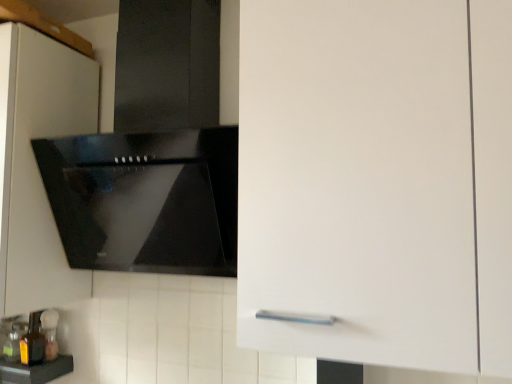
Question: Is white matte cabinet at upper left located outside black glossy countertop at lower left?

Choices:
 (A) yes
 (B) no

Answer: (A)

Question: From a real-world perspective, is white matte cabinet at upper left located beneath black glossy countertop at lower left?

Choices:
 (A) no
 (B) yes

Answer: (A)

Question: Considering the relative positions of white matte cabinet at upper left and black glossy countertop at lower left in the image provided, is white matte cabinet at upper left to the left of black glossy countertop at lower left from the viewer's perspective?

Choices:
 (A) yes
 (B) no

Answer: (B)

Question: Can you confirm if white matte cabinet at upper left is thinner than black glossy countertop at lower left?

Choices:
 (A) yes
 (B) no

Answer: (B)

Question: Is black glossy countertop at lower left inside white matte cabinet at upper left?

Choices:
 (A) yes
 (B) no

Answer: (B)

Question: In terms of width, does translucent glass bottle at lower left, marked as the second bottle in a front-to-back arrangement, look wider or thinner when compared to translucent amber bottle at lower left, which appears as the 1th bottle when viewed from the front?

Choices:
 (A) wide
 (B) thin

Answer: (B)

Question: From a real-world perspective, is translucent glass bottle at lower left, marked as the second bottle in a front-to-back arrangement, physically located above or below translucent amber bottle at lower left, positioned as the second bottle in back-to-front order?

Choices:
 (A) above
 (B) below

Answer: (B)

Question: Is translucent glass bottle at lower left, which ranks as the 1th bottle in back-to-front order, bigger or smaller than translucent amber bottle at lower left, which appears as the 1th bottle when viewed from the front?

Choices:
 (A) small
 (B) big

Answer: (A)

Question: From their relative heights in the image, would you say translucent glass bottle at lower left, which ranks as the 1th bottle in back-to-front order, is taller or shorter than translucent amber bottle at lower left, positioned as the second bottle in back-to-front order?

Choices:
 (A) tall
 (B) short

Answer: (B)

Question: Is translucent amber bottle at lower left, which appears as the 1th bottle when viewed from the front, bigger or smaller than translucent glass bottle at lower left, which ranks as the 1th bottle in back-to-front order?

Choices:
 (A) big
 (B) small

Answer: (A)

Question: In the image, is translucent amber bottle at lower left, positioned as the second bottle in back-to-front order, positioned in front of or behind translucent glass bottle at lower left, which ranks as the 1th bottle in back-to-front order?

Choices:
 (A) behind
 (B) front

Answer: (B)

Question: In the image, is translucent amber bottle at lower left, which appears as the 1th bottle when viewed from the front, on the left side or the right side of translucent glass bottle at lower left, marked as the second bottle in a front-to-back arrangement?

Choices:
 (A) left
 (B) right

Answer: (A)

Question: Is translucent amber bottle at lower left, which appears as the 1th bottle when viewed from the front, taller or shorter than translucent glass bottle at lower left, which ranks as the 1th bottle in back-to-front order?

Choices:
 (A) short
 (B) tall

Answer: (B)

Question: Is black glossy countertop at lower left to the left or to the right of translucent amber bottle at lower left, which appears as the 1th bottle when viewed from the front, in the image?

Choices:
 (A) left
 (B) right

Answer: (A)

Question: Is black glossy countertop at lower left wider or thinner than translucent amber bottle at lower left, positioned as the second bottle in back-to-front order?

Choices:
 (A) thin
 (B) wide

Answer: (B)